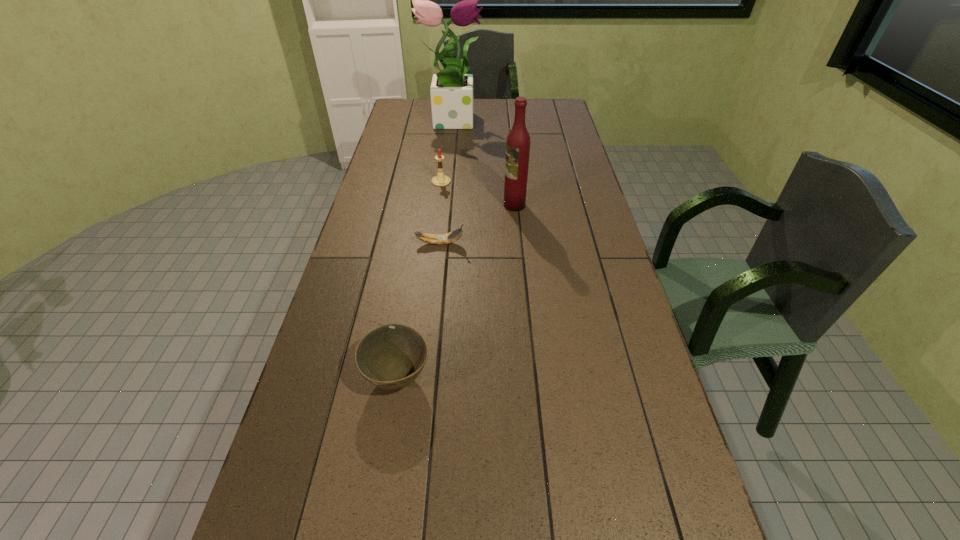
Find the location of a particular element. The height and width of the screenshot is (540, 960). free space between the rightmost object and the shortest object is located at coordinates (477, 224).

Identify which object is located as the third nearest to the fourth shortest object. Please provide its 2D coordinates. Your answer should be formatted as a tuple, i.e. [(x, y)], where the tuple contains the x and y coordinates of a point satisfying the conditions above.

[(451, 91)]

Identify the location of object that is the third closest to the shortest object. (391, 356).

Find the location of a particular element. vacant area in the image that satisfies the following two spatial constraints: 1. on the front-facing side of the tallest object; 2. on the front side of the second farthest object is located at coordinates (445, 181).